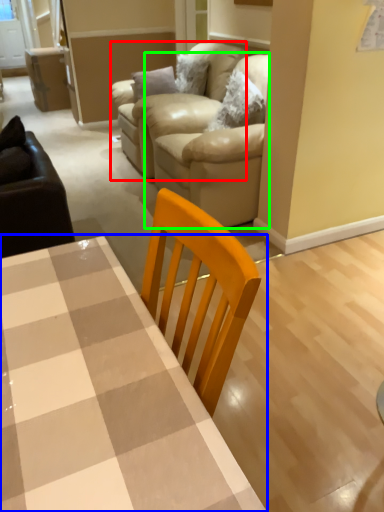
Question: Which object is the closest to the armchair (highlighted by a red box)? Choose among these: table (highlighted by a blue box) or couch (highlighted by a green box).

Choices:
 (A) table
 (B) couch

Answer: (B)